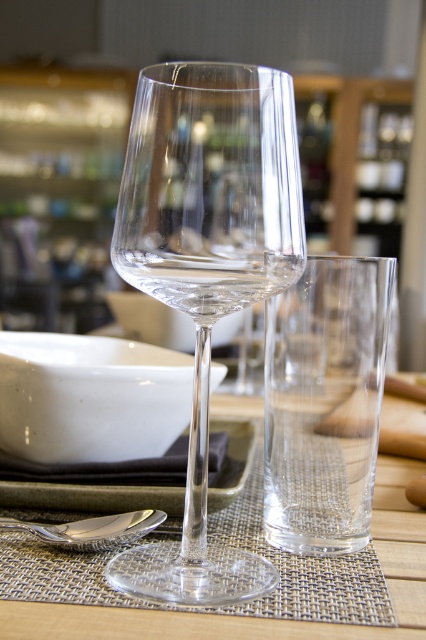
Does transparent glass at center have a lesser height compared to silver metallic spoon at lower left?

No, transparent glass at center is not shorter than silver metallic spoon at lower left.

Measure the distance from transparent glass at center to silver metallic spoon at lower left.

5.22 inches

Which is behind, point (187, 632) or point (74, 541)?

Positioned behind is point (74, 541).

The image size is (426, 640). I want to click on transparent glass at center, so click(x=262, y=618).

Between black fabric tray at center and silver metallic spoon at lower left, which one is positioned higher?

black fabric tray at center is above.

Identify the location of black fabric tray at center. The height and width of the screenshot is (640, 426). (92, 496).

Between transparent glass wine glass at center and black fabric tray at center, which one is positioned higher?

transparent glass wine glass at center

Does transparent glass wine glass at center lie behind black fabric tray at center?

No, it is in front of black fabric tray at center.

Who is more distant from viewer, (238, 230) or (86, 499)?

Point (86, 499)

The width and height of the screenshot is (426, 640). Find the location of `transparent glass wine glass at center`. transparent glass wine glass at center is located at coordinates (207, 268).